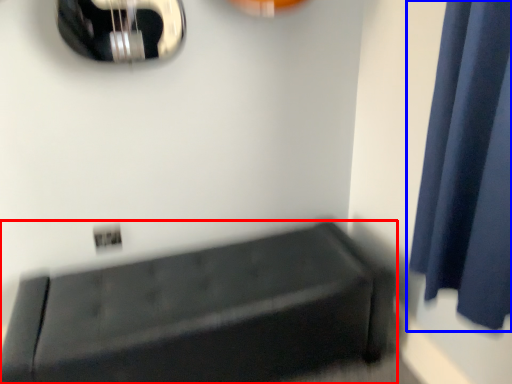
Question: Which of the following is the closest to the observer, furniture (highlighted by a red box) or curtain (highlighted by a blue box)?

Choices:
 (A) furniture
 (B) curtain

Answer: (B)